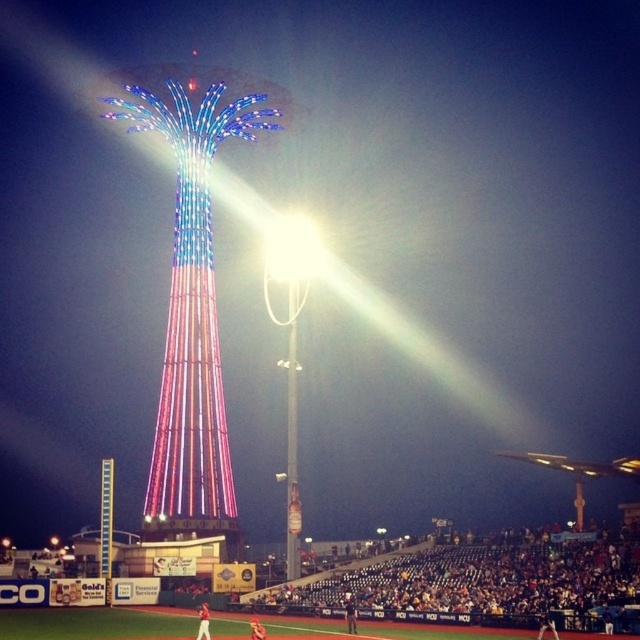
Question: Considering the relative positions of shiny metallic tower at center and dark blue jersey at lower center in the image provided, where is shiny metallic tower at center located with respect to dark blue jersey at lower center?

Choices:
 (A) below
 (B) above

Answer: (B)

Question: Which point is closer to the camera taking this photo?

Choices:
 (A) (260, 92)
 (B) (294, 228)
 (C) (540, 564)

Answer: (C)

Question: Which of the following is the closest to the observer?

Choices:
 (A) pyautogui.click(x=269, y=602)
 (B) pyautogui.click(x=305, y=243)
 (C) pyautogui.click(x=164, y=417)

Answer: (A)

Question: Does shiny metallic tower at center have a larger size compared to bright white lamp post at center?

Choices:
 (A) yes
 (B) no

Answer: (A)

Question: Which of the following is the farthest from the observer?

Choices:
 (A) (285, 244)
 (B) (205, 426)
 (C) (372, 566)

Answer: (A)

Question: Does dark blue jersey at lower center appear under bright white lamp post at center?

Choices:
 (A) no
 (B) yes

Answer: (B)